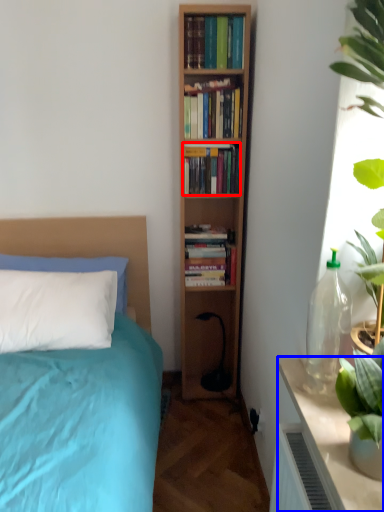
Question: Among these objects, which one is nearest to the camera, book (highlighted by a red box) or table (highlighted by a blue box)?

Choices:
 (A) book
 (B) table

Answer: (B)